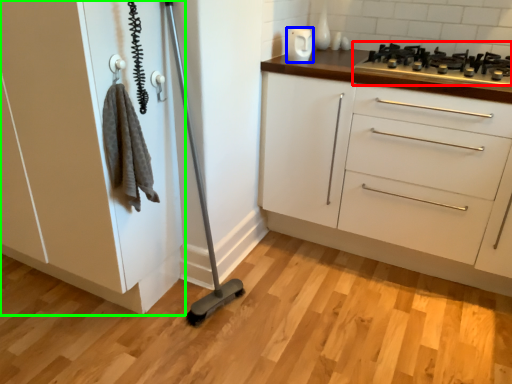
Question: Which is nearer to the gas stove (highlighted by a red box)? appliance (highlighted by a blue box) or cabinetry (highlighted by a green box).

Choices:
 (A) appliance
 (B) cabinetry

Answer: (A)